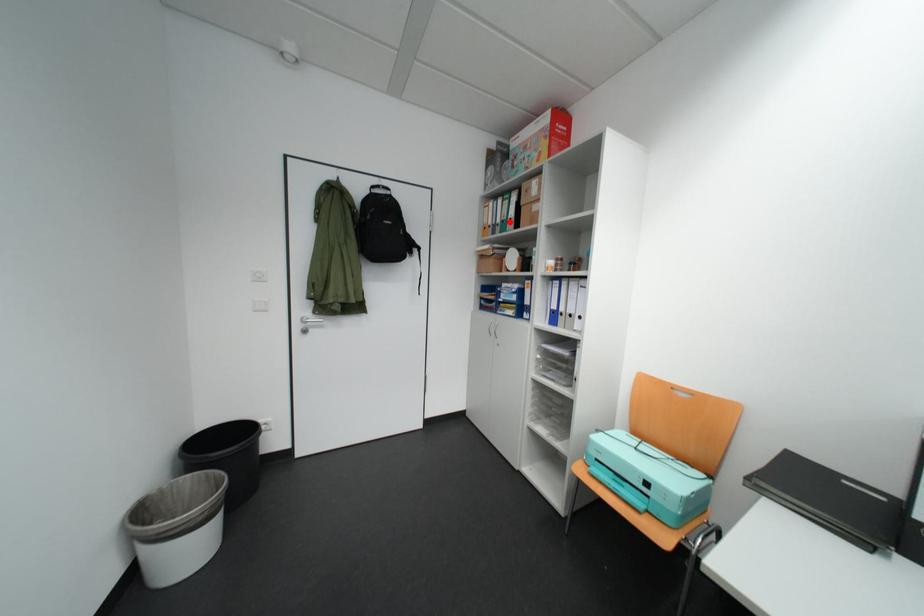
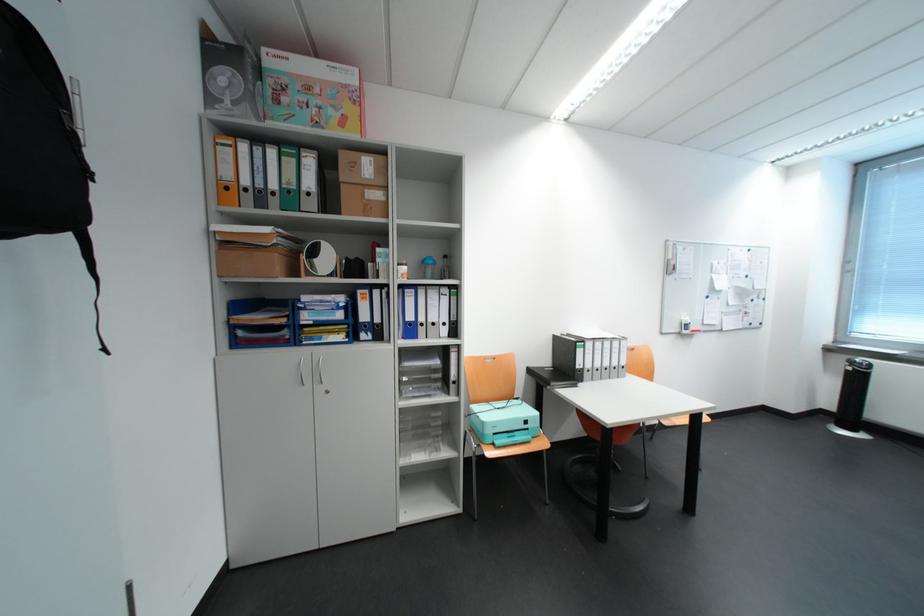
Locate, in the second image, the point that corresponds to the highlighted location in the first image.

(285, 188)